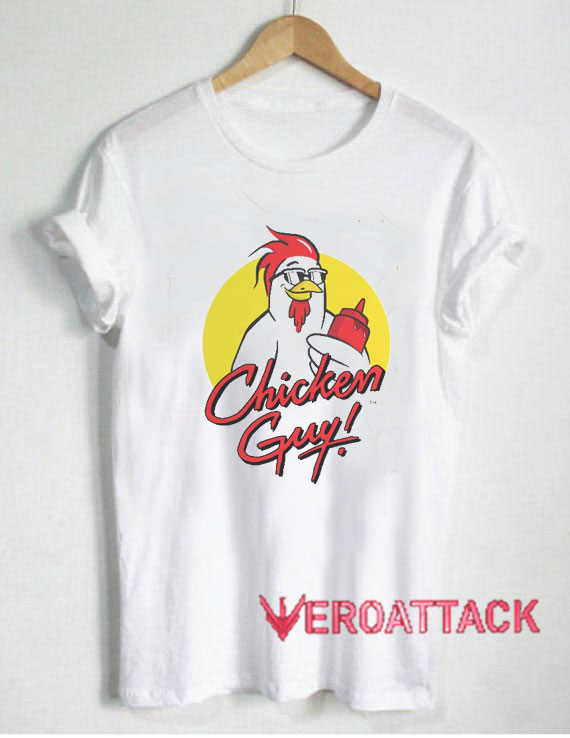
You are a GUI agent. You are given a task and a screenshot of the screen. Output one action in this format:
    pyautogui.click(x=<x>, y=<y>)
    Task: Click on the wooden hanger
    The width and height of the screenshot is (570, 738).
    Given the screenshot: What is the action you would take?
    pyautogui.click(x=283, y=29)